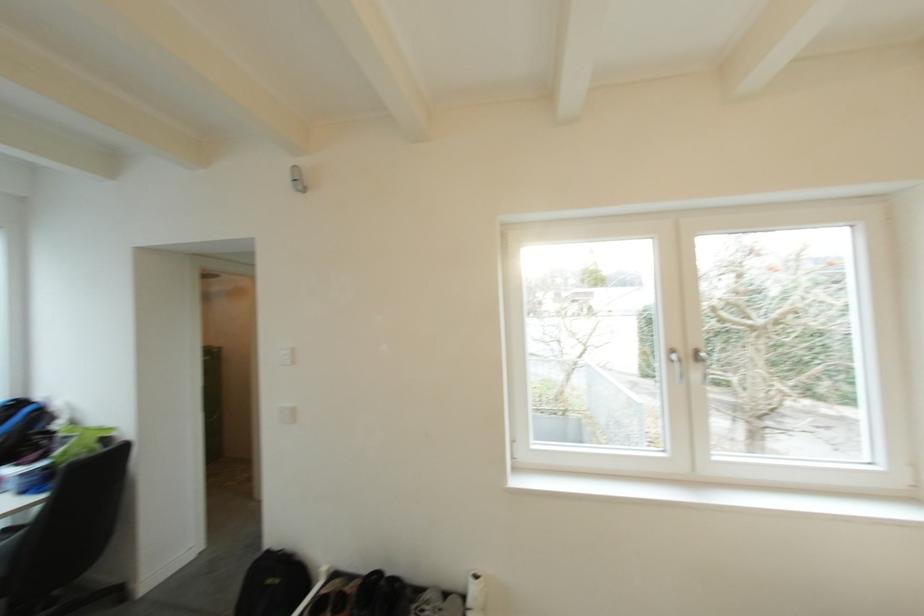
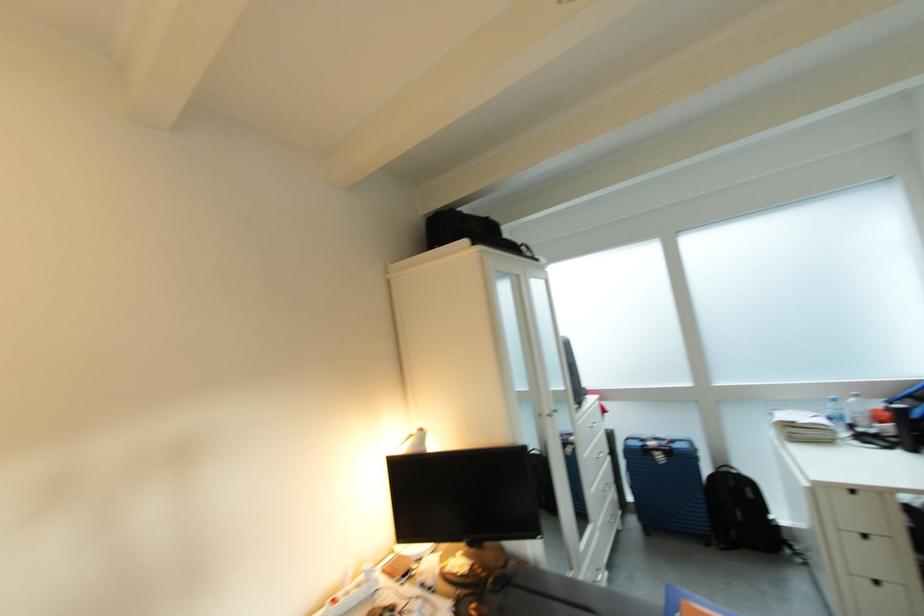
Question: Based on the continuous images, in which direction is the camera rotating? Reply with the corresponding letter.

Choices:
 (A) Left
 (B) Right
 (C) Up
 (D) Down

Answer: (A)